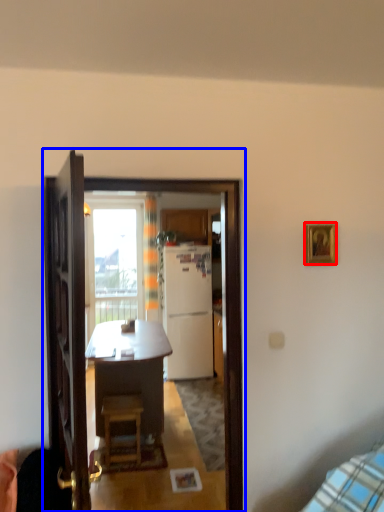
Question: Among these objects, which one is nearest to the camera, picture frame (highlighted by a red box) or screen door (highlighted by a blue box)?

Choices:
 (A) picture frame
 (B) screen door

Answer: (B)